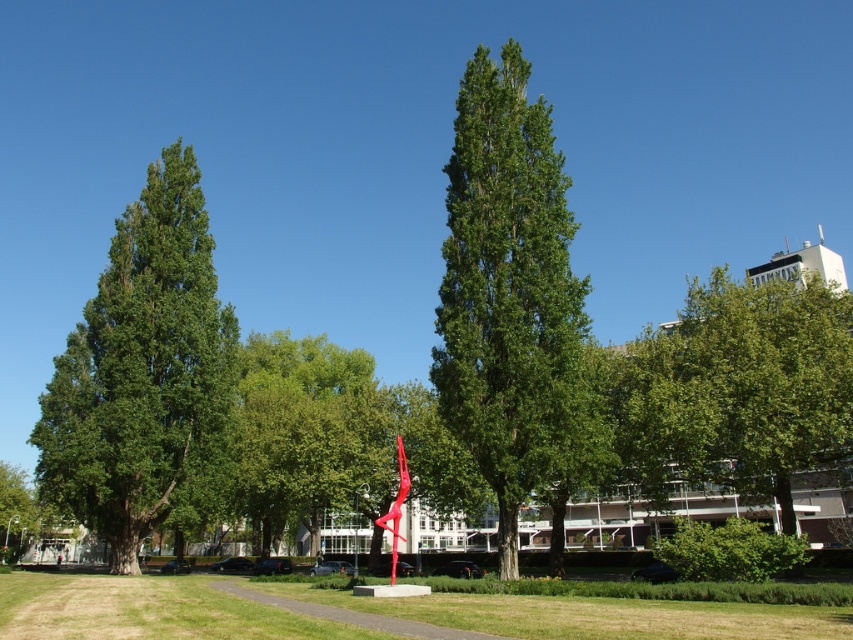
Question: Does green leafy tree at left come behind green grass at center?

Choices:
 (A) yes
 (B) no

Answer: (A)

Question: Can you confirm if green leafy tree at left is positioned to the right of metallic red sculpture at center?

Choices:
 (A) yes
 (B) no

Answer: (B)

Question: Which point is closer to the camera?

Choices:
 (A) green grass at center
 (B) green leafy tree at left
 (C) green leafy tree at center

Answer: (A)

Question: Considering the relative positions of green leafy tree at center and green leafy tree at right in the image provided, where is green leafy tree at center located with respect to green leafy tree at right?

Choices:
 (A) left
 (B) right

Answer: (A)

Question: Estimate the real-world distances between objects in this image. Which object is closer to the green leafy tree at left?

Choices:
 (A) green leafy tree at right
 (B) metallic red sculpture at center

Answer: (B)

Question: Which point is farther to the camera?

Choices:
 (A) green leafy tree at left
 (B) green leafy tree at center
 (C) green grass at center
 (D) green leafy tree at right

Answer: (A)